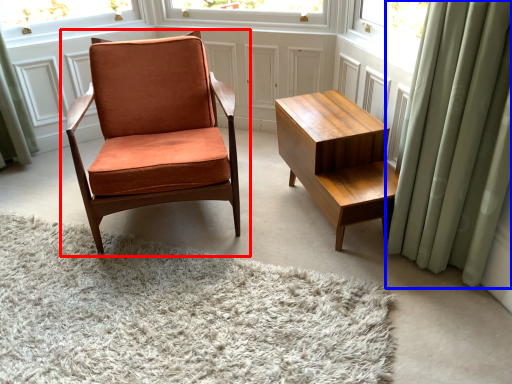
Question: Which point is further to the camera, chair (highlighted by a red box) or curtain (highlighted by a blue box)?

Choices:
 (A) chair
 (B) curtain

Answer: (A)